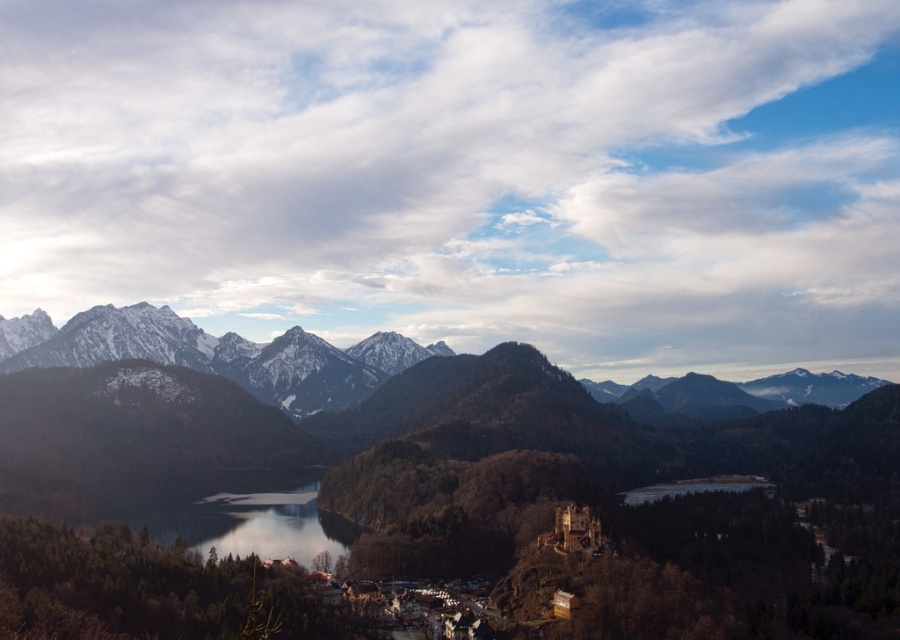
You are standing in the forest near the lake and want to reach a specific point marked as point (x=352, y=355). There is another point marked as point (x=290, y=509) that you need to avoid. Which point should you head towards to stay closer to your current position?

You should head towards point (x=352, y=355) because it is closer to your current position as it is further to the camera compared to point (x=290, y=509).

You are a hiker standing at the edge of the transparent glass lake at center. Looking towards the snowy rocky mountains at upper left, can you see the lake reflected in the mountains?

The transparent glass lake at center is behind the snowy rocky mountains at upper left, so the mountains are between you and the lake. Therefore, you cannot see the lake reflected in the mountains because the lake is located behind the mountains from your viewpoint.